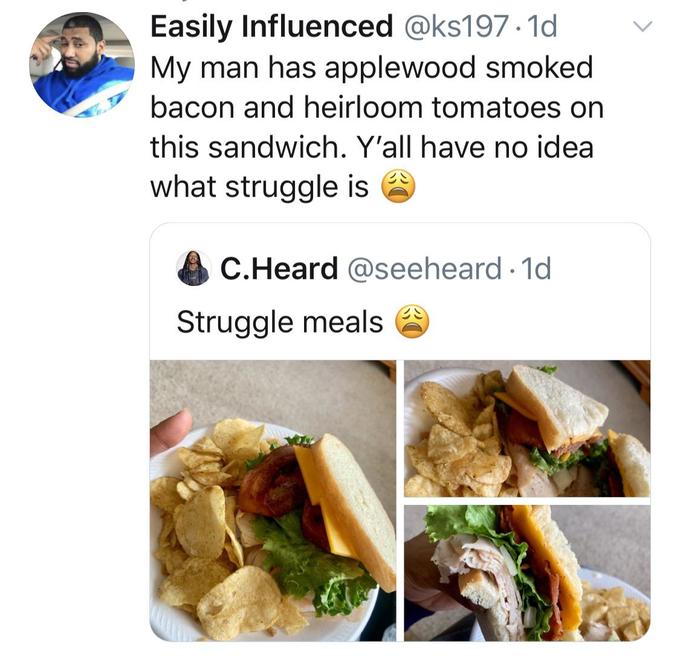
Image resolution: width=680 pixels, height=656 pixels. I want to click on carpet, so click(596, 384), click(288, 388), click(617, 556).